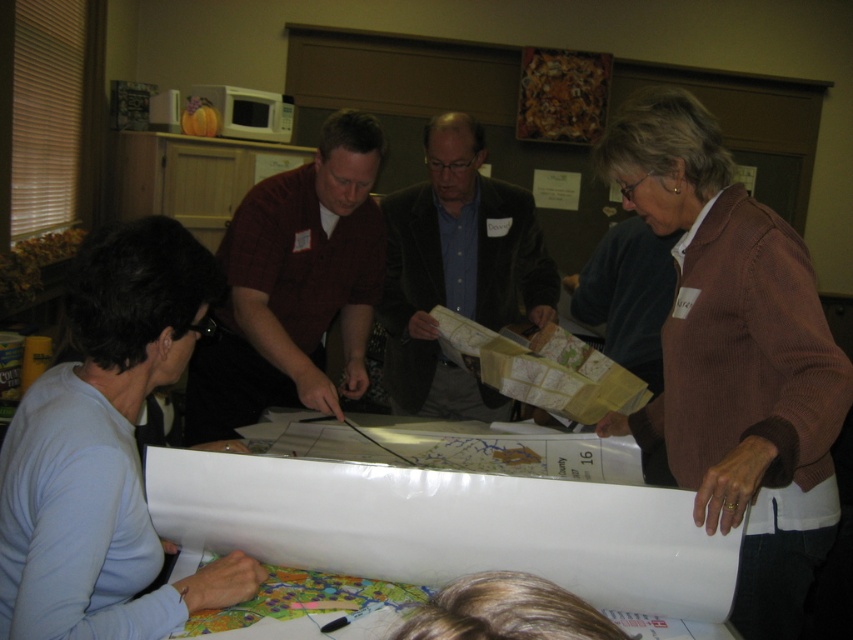
Question: Can you confirm if white paper at center is thinner than brown corduroy sweater at upper right?

Choices:
 (A) no
 (B) yes

Answer: (A)

Question: Which point is farther to the camera?

Choices:
 (A) brown corduroy sweater at upper right
 (B) maroon short-sleeved shirt at center
 (C) light blue fabric at lower left
 (D) velvet brown jacket at center

Answer: (D)

Question: Which point is closer to the camera taking this photo?

Choices:
 (A) tap(480, 320)
 (B) tap(48, 568)
 (C) tap(314, 164)

Answer: (B)

Question: Does brown corduroy sweater at upper right appear on the left side of maroon short-sleeved shirt at center?

Choices:
 (A) yes
 (B) no

Answer: (B)

Question: Among these points, which one is nearest to the camera?

Choices:
 (A) (727, 518)
 (B) (480, 234)

Answer: (A)

Question: Observing the image, what is the correct spatial positioning of light blue fabric at lower left in reference to maroon short-sleeved shirt at center?

Choices:
 (A) left
 (B) right

Answer: (A)